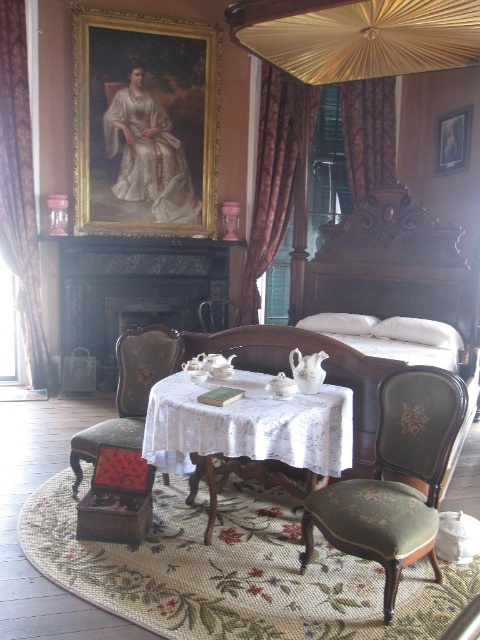
Consider the image. Can you confirm if black marble fireplace at center is positioned above white lace table at center?

Correct, black marble fireplace at center is located above white lace table at center.

Which is below, black marble fireplace at center or white lace table at center?

Positioned lower is white lace table at center.

Find the location of a particular element. The image size is (480, 640). black marble fireplace at center is located at coordinates (133, 289).

Between point (21, 132) and point (381, 83), which one is positioned behind?

Point (381, 83)

What do you see at coordinates (20, 188) in the screenshot?
I see `silky brown curtain at left` at bounding box center [20, 188].

What do you see at coordinates (20, 188) in the screenshot? The height and width of the screenshot is (640, 480). I see `silky brown curtain at left` at bounding box center [20, 188].

The height and width of the screenshot is (640, 480). Identify the location of silky brown curtain at left. (20, 188).

Does green fabric armchair at lower right have a lesser width compared to black marble fireplace at center?

Correct, green fabric armchair at lower right's width is less than black marble fireplace at center's.

Between point (392, 605) and point (64, 289), which one is positioned behind?

The point (64, 289) is behind.

The image size is (480, 640). In order to click on green fabric armchair at lower right in this screenshot , I will do `click(395, 481)`.